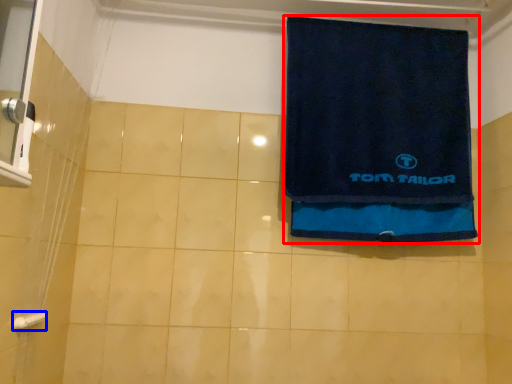
Question: Which object appears farthest to the camera in this image, towel (highlighted by a red box) or towel bar (highlighted by a blue box)?

Choices:
 (A) towel
 (B) towel bar

Answer: (A)